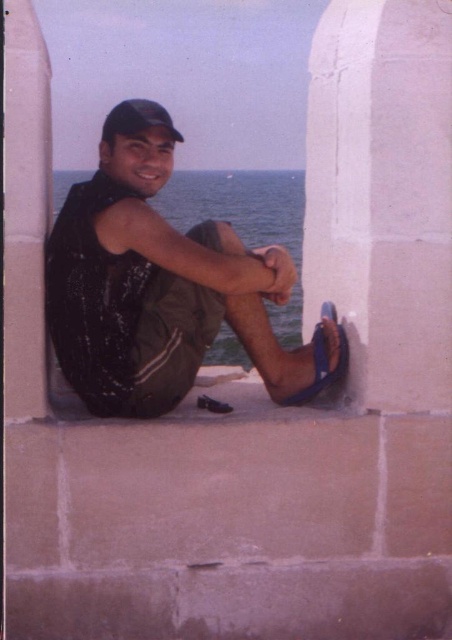
Question: Which is farther from the black matte baseball cap at upper center?

Choices:
 (A) white stone pillar at right
 (B) blue rubber sandal at lower center

Answer: (A)

Question: Among these objects, which one is nearest to the camera?

Choices:
 (A) white stone pillar at right
 (B) shiny black vest at center

Answer: (B)

Question: Does blue rubber sandal at lower center lie behind black matte baseball cap at upper center?

Choices:
 (A) no
 (B) yes

Answer: (B)

Question: Is shiny black vest at center above blue rubber sandal at lower center?

Choices:
 (A) no
 (B) yes

Answer: (B)

Question: Which is nearer to the white stone pillar at right?

Choices:
 (A) blue rubber sandal at lower center
 (B) shiny black vest at center

Answer: (A)

Question: Can you confirm if white stone pillar at right is smaller than blue rubber sandal at lower center?

Choices:
 (A) no
 (B) yes

Answer: (A)